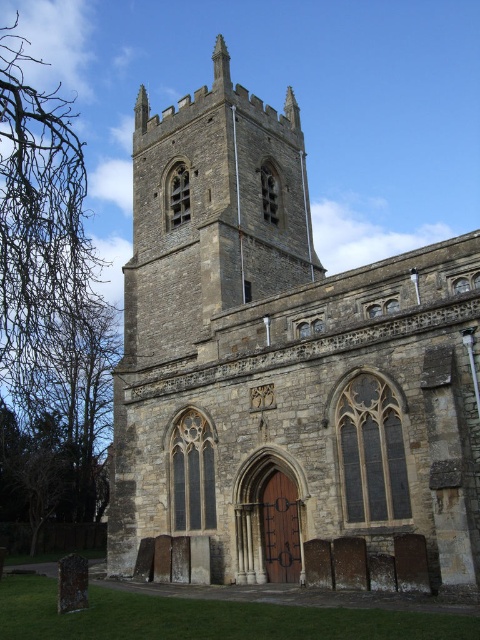
You are a tour guide leading a group around the historic site. You want to explain the distance between the stone church at center and the stone tower at center to your visitors. How far apart are they?

The stone church at center and the stone tower at center are 11.90 feet apart from each other.

You are an architect assessing the structural integrity of the stone church at center and the stone tower at center. Which structure is taller?

The stone church at center is taller than the stone tower at center according to the description.